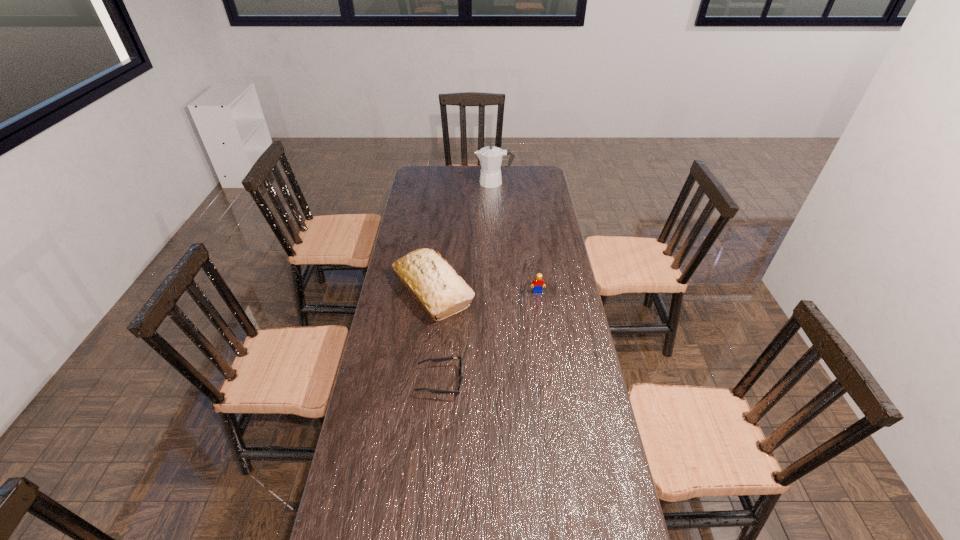
This screenshot has height=540, width=960. What are the coordinates of `free space between the shortest object and the bread` in the screenshot? It's located at (x=437, y=335).

Where is `free space between the second shortest object and the nearest object`? free space between the second shortest object and the nearest object is located at coordinates (489, 336).

Locate an element on the screen. This screenshot has height=540, width=960. blank region between the rightmost object and the tallest object is located at coordinates 516,237.

Locate an element on the screen. This screenshot has height=540, width=960. free point between the second tallest object and the farthest object is located at coordinates (464, 236).

Find the location of a particular element. The image size is (960, 540). unoccupied position between the shortest object and the bread is located at coordinates (437, 335).

The image size is (960, 540). What are the coordinates of `vacant area that lies between the shortest object and the bread` in the screenshot? It's located at (437, 335).

Where is `free space between the second shortest object and the farthest object`? The height and width of the screenshot is (540, 960). free space between the second shortest object and the farthest object is located at coordinates (516, 237).

Find the location of a particular element. unoccupied position between the coffeepot and the sunglasses is located at coordinates (468, 282).

The image size is (960, 540). In order to click on free spot between the bread and the coffeepot in this screenshot , I will do tap(464, 236).

The width and height of the screenshot is (960, 540). What are the coordinates of `vacant space in between the bread and the rightmost object` in the screenshot? It's located at (485, 291).